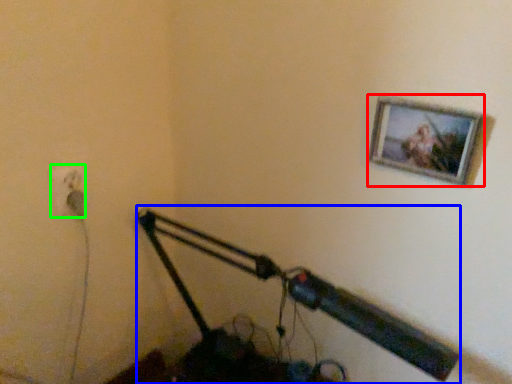
Question: Considering the real-world distances, which object is farthest from picture frame (highlighted by a red box)? lamp (highlighted by a blue box) or electric outlet (highlighted by a green box)?

Choices:
 (A) lamp
 (B) electric outlet

Answer: (B)